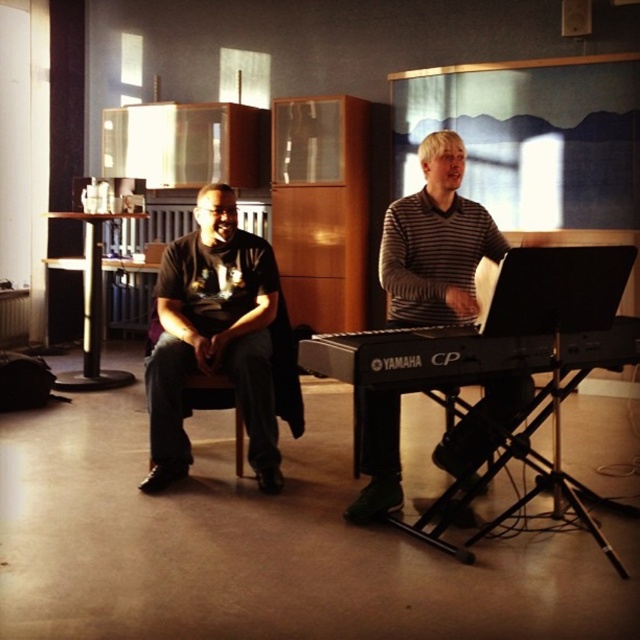
From the picture: Who is more distant from viewer, (397, 282) or (456, 376)?

The point (397, 282) is behind.

Which is more to the right, striped sweater at center or black matte keyboard at center?

black matte keyboard at center is more to the right.

Does point (461, 284) come closer to viewer compared to point (452, 381)?

No, it is not.

Find the location of `striped sweater at center`. striped sweater at center is located at coordinates (435, 243).

Between matte black shirt at left and striped sweater at center, which one appears on the right side from the viewer's perspective?

From the viewer's perspective, striped sweater at center appears more on the right side.

Does matte black shirt at left appear over striped sweater at center?

No.

Locate an element on the screen. matte black shirt at left is located at coordinates (212, 337).

Is matte black shirt at left smaller than black matte keyboard at center?

No.

From the picture: Between matte black shirt at left and black matte keyboard at center, which one is positioned higher?

matte black shirt at left is above.

What are the coordinates of `matte black shirt at left` in the screenshot? It's located at (212, 337).